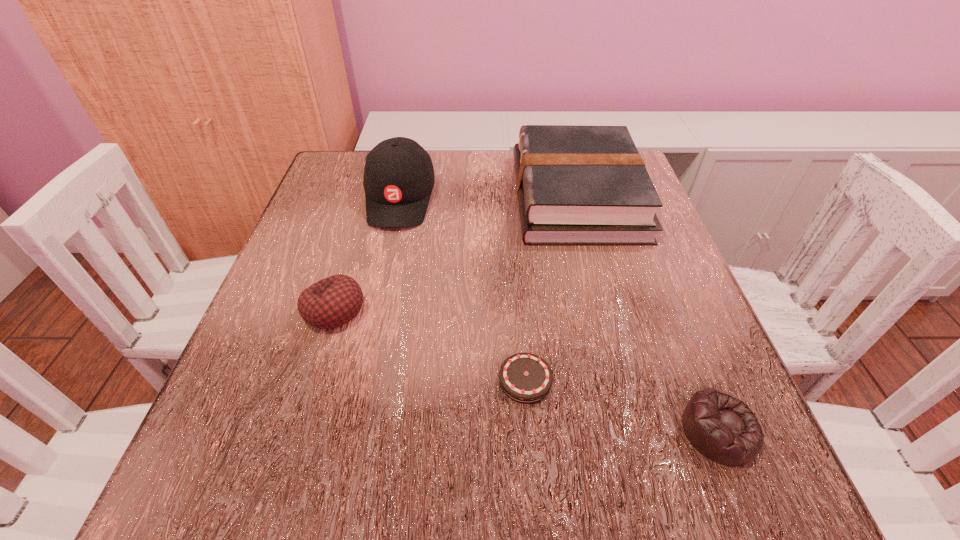
At what (x,y) coordinates should I click in order to perform the action: click on free point located 0.300m on the spine side of the second tallest object. Please return your answer as a coordinate pair (x, y). Looking at the image, I should click on (383, 197).

At what (x,y) coordinates should I click in order to perform the action: click on vacant point located on the front of the third tallest object. Please return your answer as a coordinate pair (x, y). This screenshot has width=960, height=540. Looking at the image, I should click on (306, 402).

Locate an element on the screen. This screenshot has height=540, width=960. vacant space located 0.400m on the left of the fourth tallest object is located at coordinates (390, 430).

The height and width of the screenshot is (540, 960). I want to click on vacant region located on the back of the shortest object, so click(512, 212).

Find the location of a particular element. This screenshot has height=540, width=960. baseball cap present at the far edge is located at coordinates (398, 180).

You are a GUI agent. You are given a task and a screenshot of the screen. Output one action in this format:
    pyautogui.click(x=<x>, y=<y>)
    Task: Click on the hardback book positioned at the far edge
    Image resolution: width=960 pixels, height=540 pixels.
    Given the screenshot: What is the action you would take?
    pyautogui.click(x=576, y=185)

This screenshot has height=540, width=960. Identify the location of object situated at the near edge. (722, 428).

Locate an element on the screen. This screenshot has width=960, height=540. baseball cap located in the left edge section of the desktop is located at coordinates (398, 180).

This screenshot has width=960, height=540. Identify the location of beanbag present at the left edge. (333, 301).

You are a GUI agent. You are given a task and a screenshot of the screen. Output one action in this format:
    pyautogui.click(x=<x>, y=<y>)
    Task: Click on the hardback book that is at the right edge
    
    Given the screenshot: What is the action you would take?
    pyautogui.click(x=576, y=185)